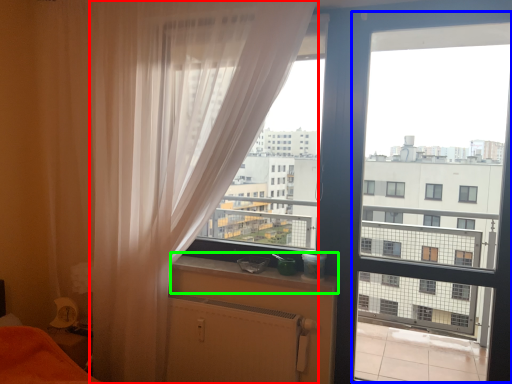
Question: Estimate the real-world distances between objects in this image. Which object is closer to curtain (highlighted by a red box), screen door (highlighted by a blue box) or window sill (highlighted by a green box)?

Choices:
 (A) screen door
 (B) window sill

Answer: (B)